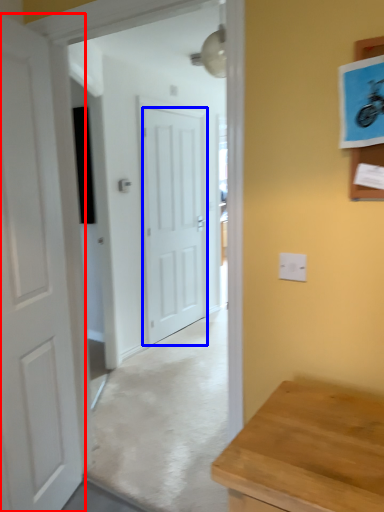
Question: Which object is closer to the camera taking this photo, door (highlighted by a red box) or door (highlighted by a blue box)?

Choices:
 (A) door
 (B) door

Answer: (A)